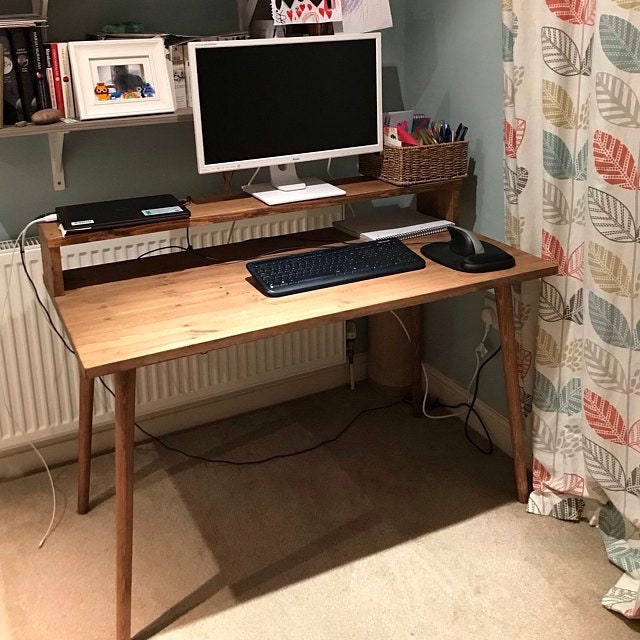
This screenshot has width=640, height=640. I want to click on shades, so click(552, 400).